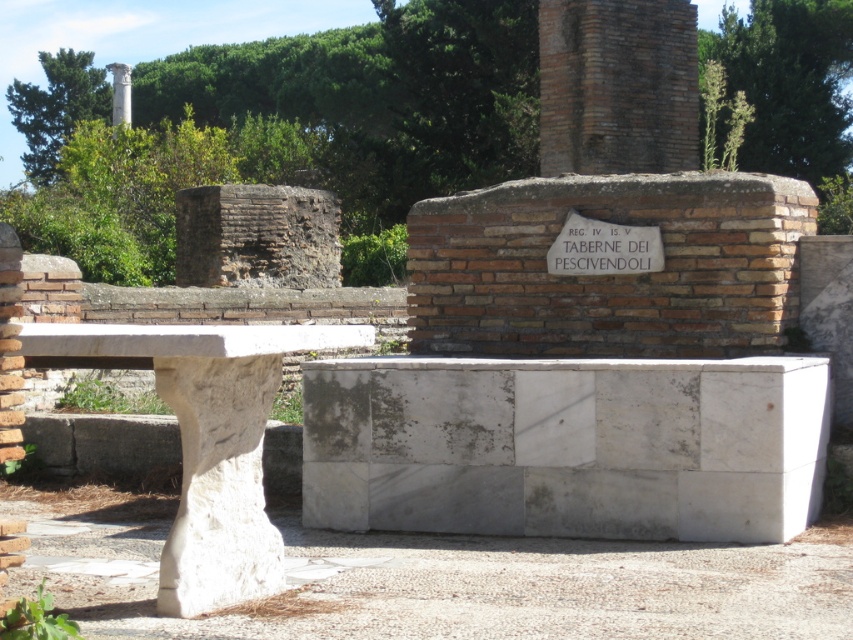
Between brown brick column at upper center and white stone column at upper left, which one has more height?

Standing taller between the two is white stone column at upper left.

In the scene shown: Which is below, brown brick column at upper center or white stone column at upper left?

Positioned lower is brown brick column at upper center.

Which is behind, point (628, 44) or point (114, 76)?

Positioned behind is point (114, 76).

Where is `brown brick column at upper center`? brown brick column at upper center is located at coordinates (618, 84).

Measure the distance between point (250, 236) and camera.

They are 26.76 meters apart.

Between brown brick wall at upper left and white marble plaque at center, which one appears on the right side from the viewer's perspective?

white marble plaque at center

You are a GUI agent. You are given a task and a screenshot of the screen. Output one action in this format:
    pyautogui.click(x=<x>, y=<y>)
    Task: Click on the brown brick wall at upper left
    Image resolution: width=853 pixels, height=640 pixels.
    Given the screenshot: What is the action you would take?
    pyautogui.click(x=257, y=236)

This screenshot has width=853, height=640. I want to click on brown brick wall at upper left, so point(257,236).

From the picture: Who is positioned more to the right, white marble bench at lower left or white marble plaque at center?

white marble plaque at center

Can you confirm if white marble bench at lower left is positioned above white marble plaque at center?

Incorrect, white marble bench at lower left is not positioned above white marble plaque at center.

Locate an element on the screen. The height and width of the screenshot is (640, 853). white marble bench at lower left is located at coordinates point(206,440).

What are the coordinates of `white marble bench at lower left` in the screenshot? It's located at (206, 440).